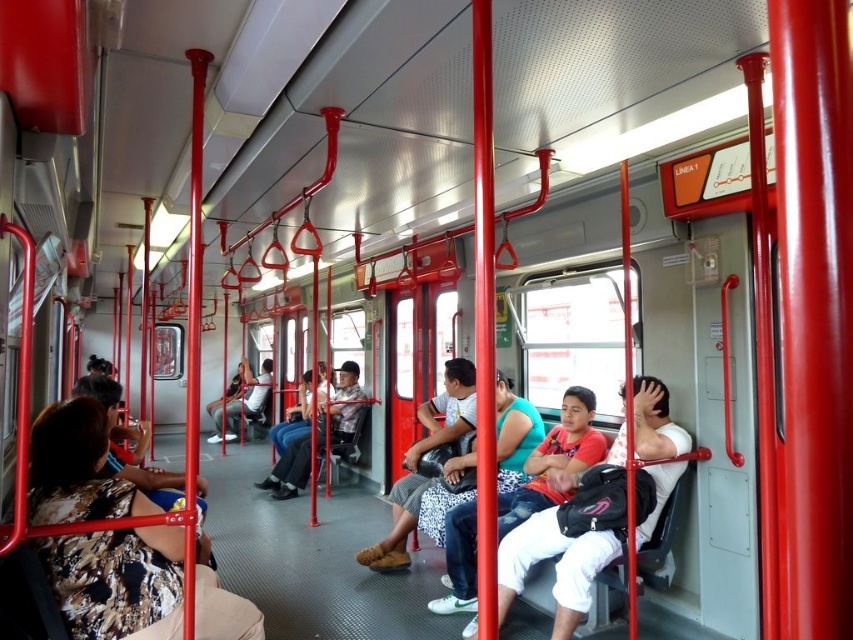
Does matte red shirt at center appear under white cotton shirt at center?

Incorrect, matte red shirt at center is not positioned below white cotton shirt at center.

Is point (659, 452) positioned before point (573, 440)?

Yes.

The height and width of the screenshot is (640, 853). Find the location of `matte red shirt at center`. matte red shirt at center is located at coordinates (555, 564).

Can you confirm if floral fabric shirt at left is positioned to the left of white cotton shirt at center?

Indeed, floral fabric shirt at left is positioned on the left side of white cotton shirt at center.

Locate an element on the screen. Image resolution: width=853 pixels, height=640 pixels. floral fabric shirt at left is located at coordinates (119, 580).

Who is more distant from viewer, (216,586) or (471,589)?

The point (471,589) is behind.

This screenshot has height=640, width=853. What are the coordinates of `floral fabric shirt at left` in the screenshot? It's located at (119, 580).

Can you confirm if floral fabric shirt at left is positioned to the left of matte red shirt at center?

Indeed, floral fabric shirt at left is positioned on the left side of matte red shirt at center.

Is the position of floral fabric shirt at left less distant than that of matte red shirt at center?

Yes, floral fabric shirt at left is closer to the viewer.

Between point (96, 605) and point (645, 449), which one is positioned in front?

Point (96, 605)

Locate an element on the screen. This screenshot has width=853, height=640. floral fabric shirt at left is located at coordinates (119, 580).